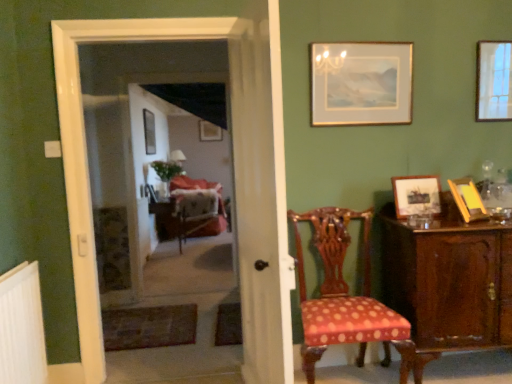
Question: Is wooden picture frame at right, which is the 5th picture frame in left-to-right order, turned away from velvet upholstered armchair at center?

Choices:
 (A) yes
 (B) no

Answer: (A)

Question: Does wooden picture frame at right, marked as the first picture frame in a front-to-back arrangement, have a smaller size compared to velvet upholstered armchair at center?

Choices:
 (A) yes
 (B) no

Answer: (A)

Question: From a real-world perspective, is wooden picture frame at right, marked as the first picture frame in a front-to-back arrangement, over velvet upholstered armchair at center?

Choices:
 (A) yes
 (B) no

Answer: (A)

Question: Could velvet upholstered armchair at center be considered to be inside wooden picture frame at right, marked as the first picture frame in a front-to-back arrangement?

Choices:
 (A) yes
 (B) no

Answer: (B)

Question: Can you confirm if wooden picture frame at right, which ranks as the 6th picture frame in back-to-front order, is positioned to the right of velvet upholstered armchair at center?

Choices:
 (A) no
 (B) yes

Answer: (B)

Question: Is white sheer curtain at center inside the boundaries of matte gold picture frame at center, positioned as the sixth picture frame in front-to-back order, or outside?

Choices:
 (A) inside
 (B) outside

Answer: (B)

Question: Is white sheer curtain at center wider or thinner than matte gold picture frame at center, placed as the second picture frame when sorted from left to right?

Choices:
 (A) thin
 (B) wide

Answer: (B)

Question: From their relative heights in the image, would you say white sheer curtain at center is taller or shorter than matte gold picture frame at center, positioned as the sixth picture frame in front-to-back order?

Choices:
 (A) tall
 (B) short

Answer: (A)

Question: Based on their sizes in the image, would you say white sheer curtain at center is bigger or smaller than matte gold picture frame at center, which appears as the fifth picture frame when viewed from the right?

Choices:
 (A) small
 (B) big

Answer: (B)

Question: From a real-world perspective, is white sheer curtain at center physically located above or below velvet upholstered armchair at center?

Choices:
 (A) above
 (B) below

Answer: (A)

Question: In terms of width, does white sheer curtain at center look wider or thinner when compared to velvet upholstered armchair at center?

Choices:
 (A) thin
 (B) wide

Answer: (A)

Question: Considering the relative positions of white sheer curtain at center and velvet upholstered armchair at center in the image provided, is white sheer curtain at center to the left or to the right of velvet upholstered armchair at center?

Choices:
 (A) right
 (B) left

Answer: (A)

Question: Considering the positions of white sheer curtain at center and velvet upholstered armchair at center in the image, is white sheer curtain at center taller or shorter than velvet upholstered armchair at center?

Choices:
 (A) short
 (B) tall

Answer: (B)

Question: From the image's perspective, is mahogany cabinet at right positioned above or below velvet upholstered armchair at center?

Choices:
 (A) above
 (B) below

Answer: (B)

Question: From their relative heights in the image, would you say mahogany cabinet at right is taller or shorter than velvet upholstered armchair at center?

Choices:
 (A) tall
 (B) short

Answer: (A)